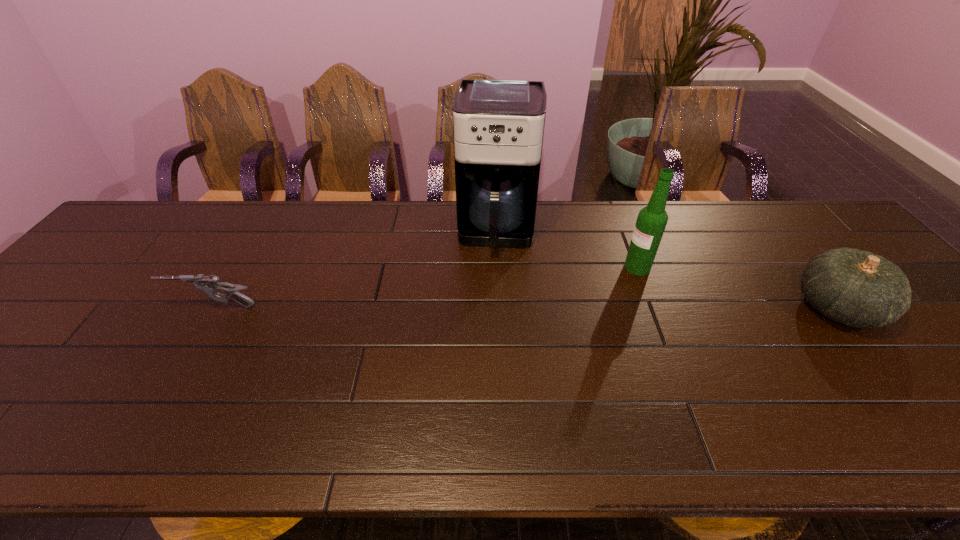
Identify the location of vacant space that's between the rightmost object and the third object from left to right. Image resolution: width=960 pixels, height=540 pixels. (737, 287).

Where is `free spot between the rightmost object and the coffee maker`? This screenshot has height=540, width=960. free spot between the rightmost object and the coffee maker is located at coordinates (667, 269).

The image size is (960, 540). Find the location of `vacant point located between the third object from right to left and the third object from left to right`. vacant point located between the third object from right to left and the third object from left to right is located at coordinates (567, 248).

Find the location of `object that is the closest to the third object from right to left`. object that is the closest to the third object from right to left is located at coordinates (651, 221).

At what (x,y) coordinates should I click in order to perform the action: click on object that ranks as the third closest to the third object from right to left. Please return your answer as a coordinate pair (x, y). Looking at the image, I should click on (857, 288).